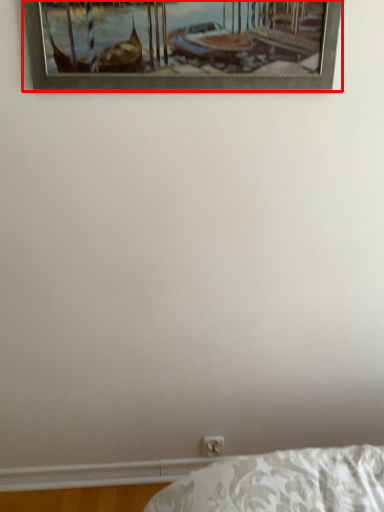
Question: From the image, what is the correct spatial relationship of picture frame (annotated by the red box) in relation to electric outlet?

Choices:
 (A) right
 (B) left

Answer: (B)